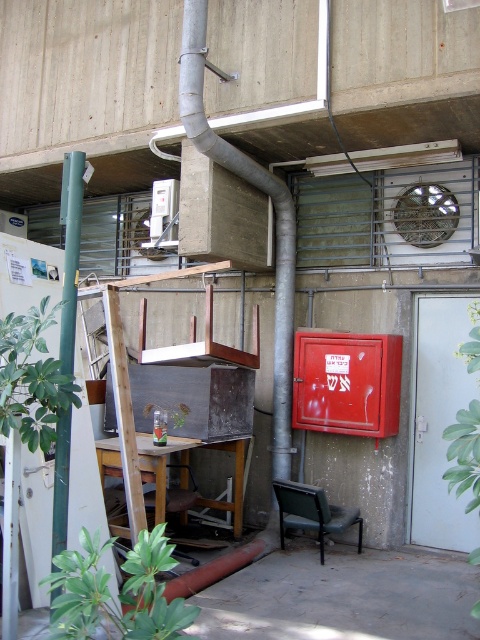
Is silver metallic pipe at upper center shorter than green matte pole at left?

No, silver metallic pipe at upper center is not shorter than green matte pole at left.

Which is in front, point (277, 461) or point (62, 310)?

Point (62, 310) is in front.

Identify the location of silver metallic pipe at upper center. This screenshot has width=480, height=640. (275, 218).

Measure the distance from silver metallic pipe at upper center to green fabric chair at lower center.

silver metallic pipe at upper center and green fabric chair at lower center are 5.08 feet apart from each other.

Between silver metallic pipe at upper center and green fabric chair at lower center, which one appears on the left side from the viewer's perspective?

From the viewer's perspective, silver metallic pipe at upper center appears more on the left side.

Does point (288, 461) come closer to viewer compared to point (360, 536)?

No, it is not.

At what (x,y) coordinates should I click in order to perform the action: click on silver metallic pipe at upper center. Please return your answer as a coordinate pair (x, y). Looking at the image, I should click on (275, 218).

Between point (69, 460) and point (312, 486), which one is positioned in front?

Point (69, 460) is in front.

Is point (68, 314) closer to camera compared to point (277, 497)?

Yes, point (68, 314) is in front of point (277, 497).

Who is more forward, (66, 461) or (279, 529)?

Point (66, 461) is more forward.

Where is `green matte pole at left`? green matte pole at left is located at coordinates (71, 252).